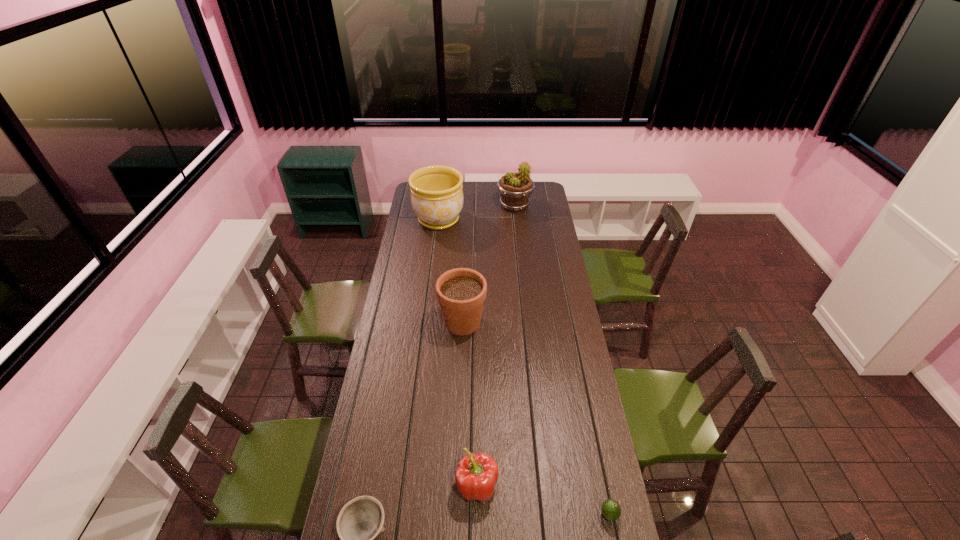
You are a GUI agent. You are given a task and a screenshot of the screen. Output one action in this format:
    pyautogui.click(x=<x>, y=<y>)
    Task: Click on the object that is at the far edge
    
    Given the screenshot: What is the action you would take?
    pyautogui.click(x=515, y=188)

I want to click on object situated at the left edge, so click(x=437, y=198).

At what (x,y) coordinates should I click in order to perform the action: click on flowerpot that is at the right edge. Please return your answer as a coordinate pair (x, y). Looking at the image, I should click on (515, 188).

Find the location of a particular element. This screenshot has width=960, height=540. avocado present at the right edge is located at coordinates (610, 508).

Identify the location of object that is at the far right corner. (515, 188).

The width and height of the screenshot is (960, 540). Identify the location of free space at the left edge of the desktop. (372, 492).

The height and width of the screenshot is (540, 960). Identify the location of free region at the right edge of the desktop. (574, 496).

Locate an element on the screen. vacant space in between the third tallest object and the rightmost flowerpot is located at coordinates (489, 264).

Locate an element on the screen. Image resolution: width=960 pixels, height=540 pixels. unoccupied area between the fifth tallest object and the third shortest object is located at coordinates (543, 500).

Locate an element on the screen. free space between the shortest flowerpot and the third shortest object is located at coordinates click(x=469, y=404).